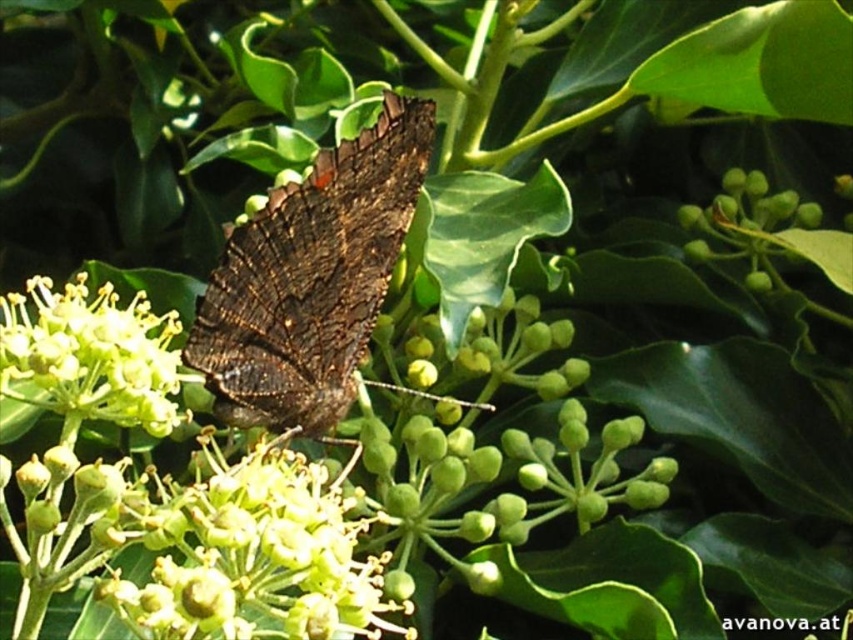
Does yellow-green textured flower at center have a larger size compared to yellow-green textured flower at center-left?

Correct, yellow-green textured flower at center is larger in size than yellow-green textured flower at center-left.

Is yellow-green textured flower at center taller than yellow-green textured flower at center-left?

Correct, yellow-green textured flower at center is much taller as yellow-green textured flower at center-left.

Find the location of `yellow-green textured flower at center`. yellow-green textured flower at center is located at coordinates (254, 556).

Identify the location of yellow-green textured flower at center. The height and width of the screenshot is (640, 853). (254, 556).

In the scene shown: Is dark brown textured butterfly at center to the left of yellow-green textured flower at center-left from the viewer's perspective?

Incorrect, dark brown textured butterfly at center is not on the left side of yellow-green textured flower at center-left.

Does dark brown textured butterfly at center appear on the right side of yellow-green textured flower at center-left?

Correct, you'll find dark brown textured butterfly at center to the right of yellow-green textured flower at center-left.

This screenshot has height=640, width=853. Find the location of `dark brown textured butterfly at center`. dark brown textured butterfly at center is located at coordinates (311, 280).

The width and height of the screenshot is (853, 640). What do you see at coordinates (311, 280) in the screenshot?
I see `dark brown textured butterfly at center` at bounding box center [311, 280].

Find the location of a particular element. dark brown textured butterfly at center is located at coordinates (311, 280).